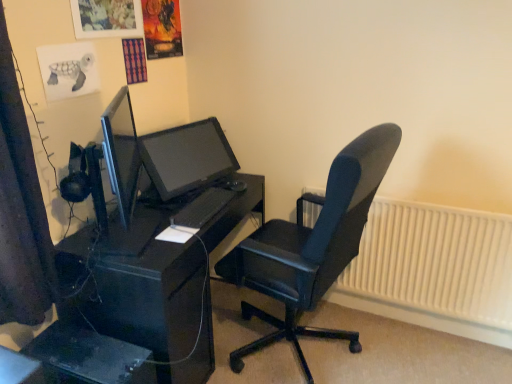
Question: Which is correct: black matte keyboard at center is inside black plastic computer tower at lower left, or outside of it?

Choices:
 (A) outside
 (B) inside

Answer: (A)

Question: From the image's perspective, is black matte keyboard at center positioned above or below black plastic computer tower at lower left?

Choices:
 (A) above
 (B) below

Answer: (A)

Question: Which is farther from the watercolor paper turtle at upper left?

Choices:
 (A) black fabric curtain at left
 (B) black leather office chair at center
 (C) black plastic computer tower at lower left
 (D) white plastic radiator at right
 (E) black matte keyboard at center

Answer: (D)

Question: Estimate the real-world distances between objects in this image. Which object is farther from the black fabric curtain at left?

Choices:
 (A) white plastic radiator at right
 (B) black matte keyboard at center
 (C) black plastic computer tower at lower left
 (D) black glossy desk at center
 (E) black leather office chair at center

Answer: (A)